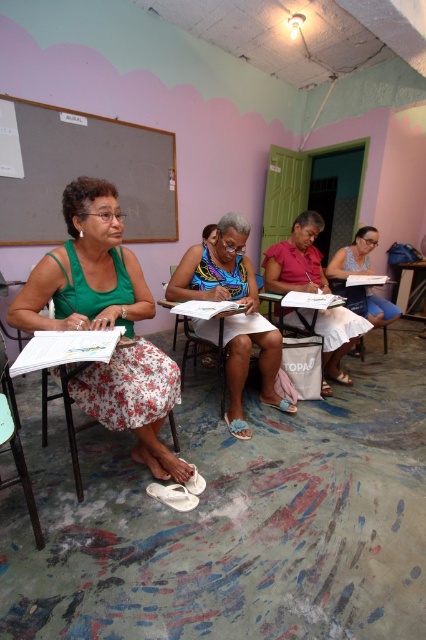
Which is more to the right, wooden table at center or wooden chair at center?

wooden table at center is more to the right.

Which of these two, wooden table at center or wooden chair at center, stands taller?

wooden table at center is taller.

Who is more forward, (417, 298) or (218, 369)?

Positioned in front is point (218, 369).

You are a GUI agent. You are given a task and a screenshot of the screen. Output one action in this format:
    pyautogui.click(x=<x>, y=<y>)
    Task: Click on the wooden table at center
    The height and width of the screenshot is (640, 426).
    Given the screenshot: What is the action you would take?
    tap(409, 289)

Can you confirm if green fabric dress at center is positioned to the right of matte grayboard at upper left?

Indeed, green fabric dress at center is positioned on the right side of matte grayboard at upper left.

Which is behind, point (141, 454) or point (126, 166)?

The point (126, 166) is behind.

Where is `green fabric dress at center`? The image size is (426, 640). green fabric dress at center is located at coordinates (106, 323).

Does point (71, 198) come behind point (342, 269)?

No, it is not.

Is green fabric dress at center positioned before white paper at right?

Yes, it is.

Which is in front, point (135, 406) or point (350, 257)?

Positioned in front is point (135, 406).

The width and height of the screenshot is (426, 640). In order to click on green fabric dress at center in this screenshot , I will do `click(106, 323)`.